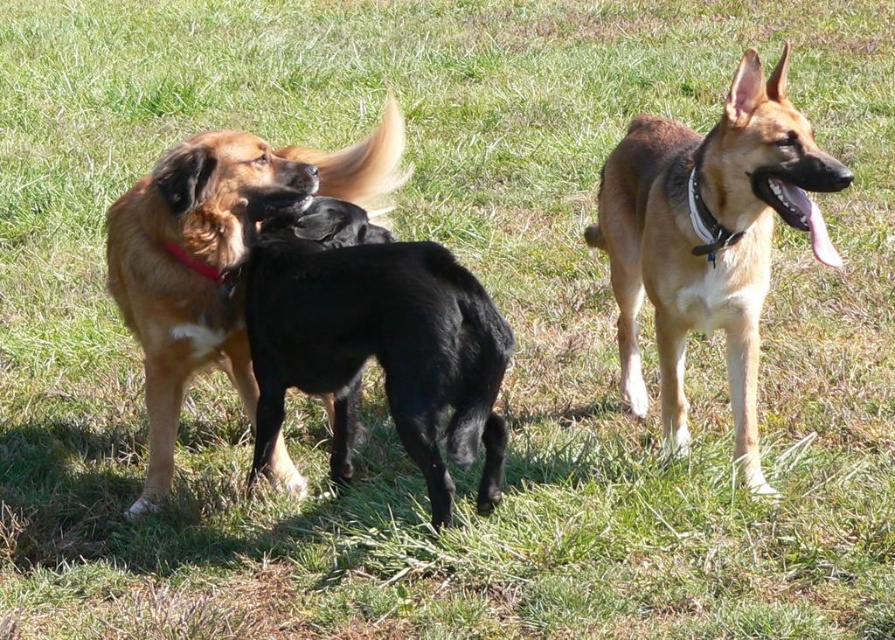
Does golden fur dog at center lie behind black smooth dog at center?

That is False.

Is golden fur dog at center taller than black smooth dog at center?

Correct, golden fur dog at center is much taller as black smooth dog at center.

Identify the location of golden fur dog at center. This screenshot has width=895, height=640. (709, 237).

What do you see at coordinates (709, 237) in the screenshot? The height and width of the screenshot is (640, 895). I see `golden fur dog at center` at bounding box center [709, 237].

Does golden fur dog at center lie behind brown fur dog at center?

No, golden fur dog at center is closer to the viewer.

Which is behind, point (734, 310) or point (135, 248)?

The point (135, 248) is behind.

The width and height of the screenshot is (895, 640). I want to click on golden fur dog at center, so click(x=709, y=237).

Who is higher up, black smooth dog at center or brown fur dog at center?

brown fur dog at center is higher up.

Can you confirm if black smooth dog at center is taller than brown fur dog at center?

In fact, black smooth dog at center may be shorter than brown fur dog at center.

In order to click on black smooth dog at center in this screenshot , I will do `click(376, 340)`.